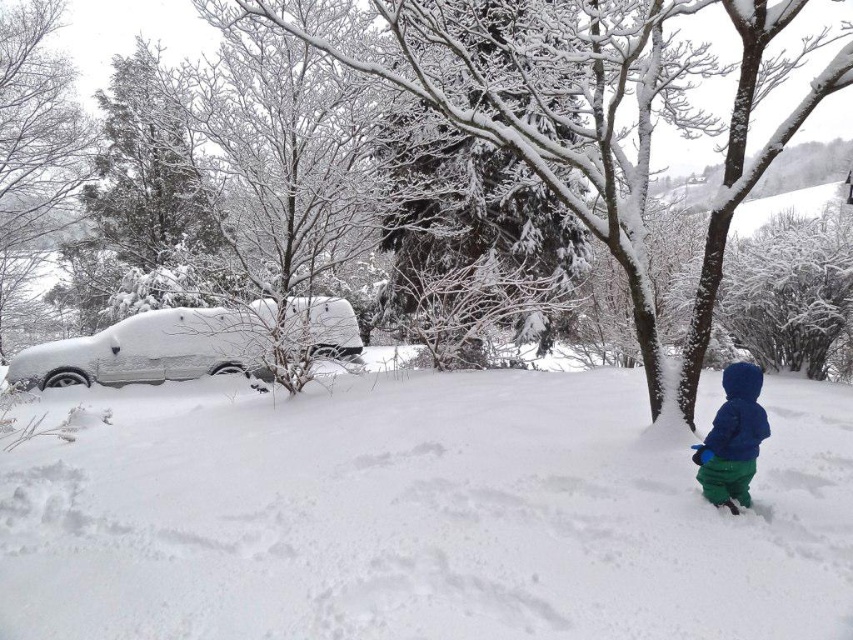
You are a delivery robot with a 3.5 feet wide package. You need to move from the white fluffy snow at lower left to the blue fleece jacket at lower right. Can you navigate the path between them?

The distance between the white fluffy snow at lower left and blue fleece jacket at lower right is 6.88 feet. Since the package is 3.5 feet wide, the robot can navigate the path as the distance is sufficient to accommodate the package width.

Consider the image. You are a photographer trying to capture the white fluffy snow at lower left in the image. Based on its coordinates, where should you focus your camera to ensure it is centered in the frame?

To center the white fluffy snow at lower left in the frame, focus your camera at the coordinates point where it is located, which is at point (421, 516).